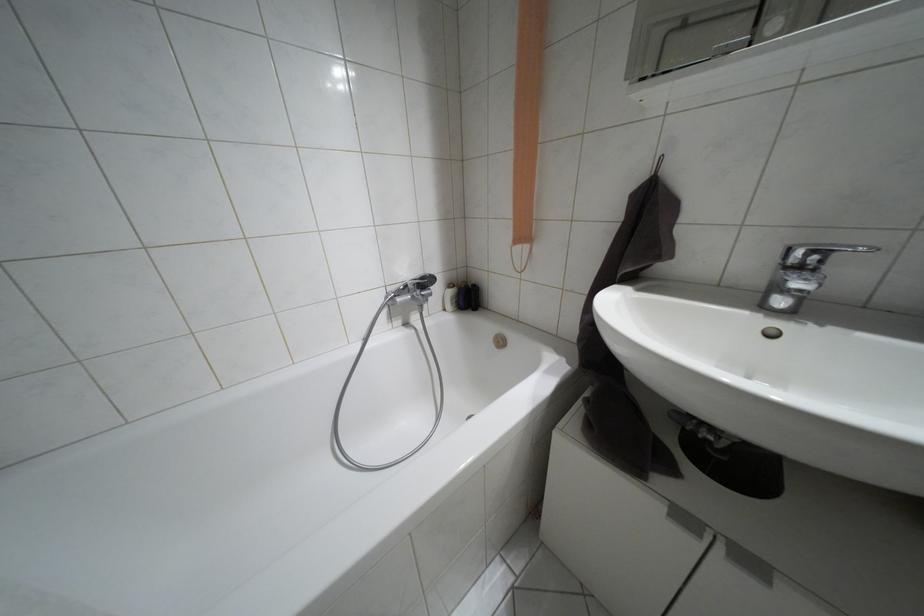
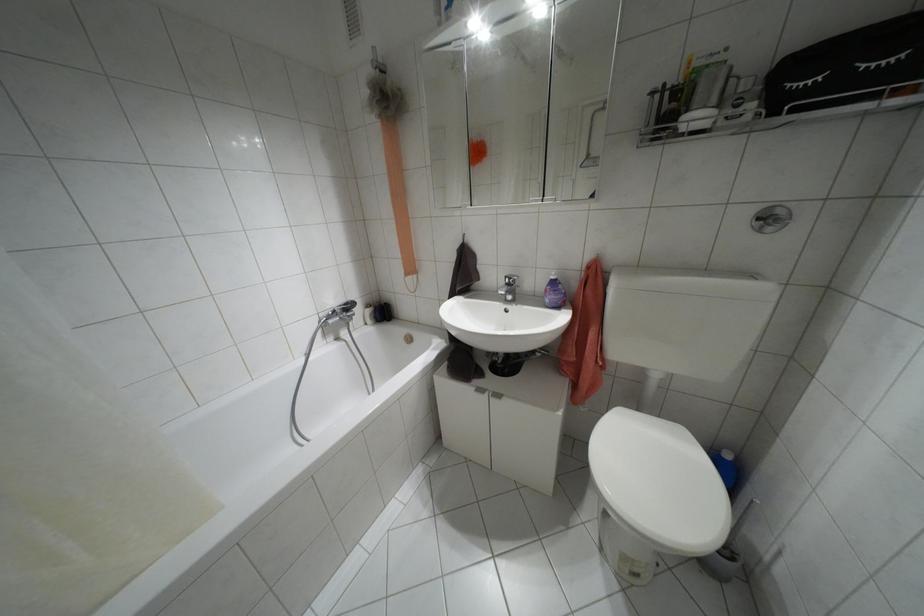
Where in the second image is the point corresponding to point (797, 269) from the first image?

(507, 284)